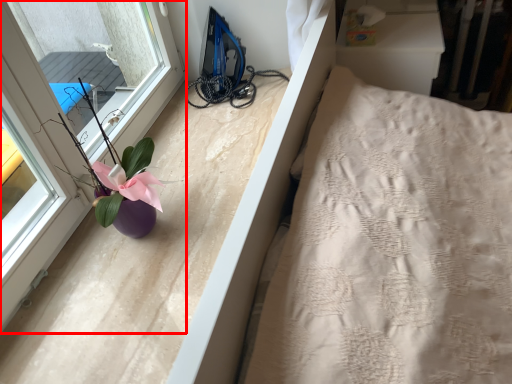
Question: Considering the relative positions of window (annotated by the red box) and floral arrangement in the image provided, where is window (annotated by the red box) located with respect to the staircase?

Choices:
 (A) left
 (B) right

Answer: (A)